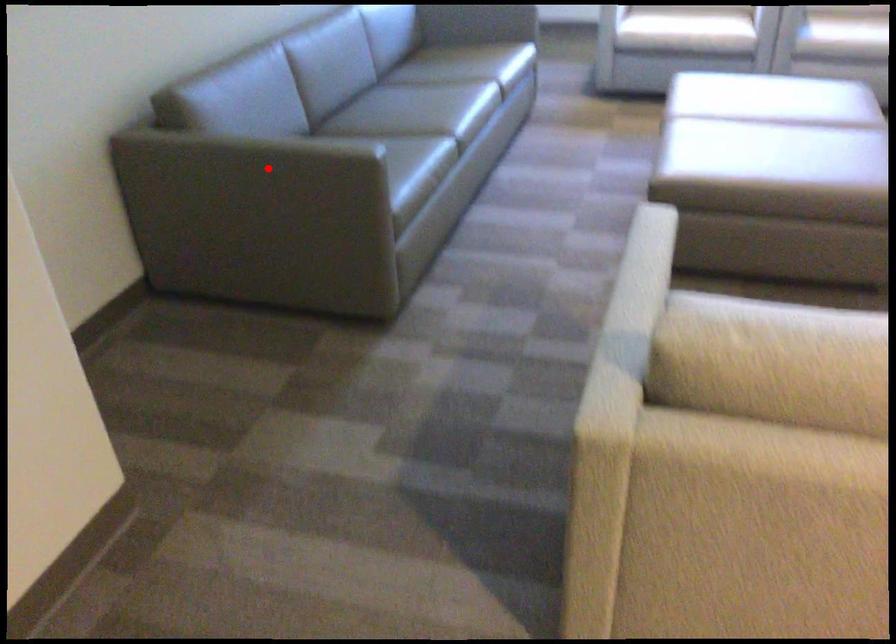
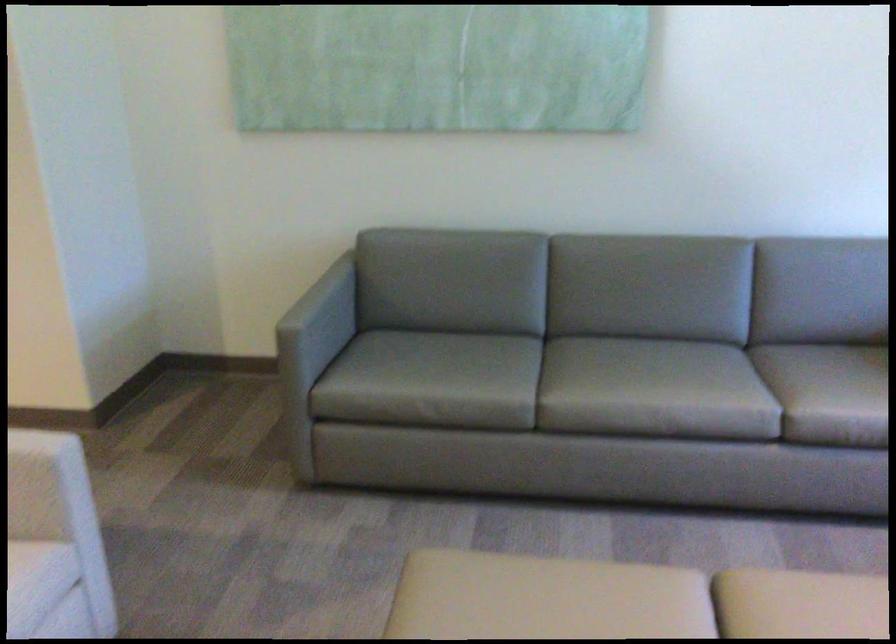
Question: I am providing you with two images of the same scene from different viewpoints. In image1, a red point is highlighted. Considering the same 3D point in image2, which of the following is correct?

Choices:
 (A) It is closer
 (B) It is farther

Answer: (B)